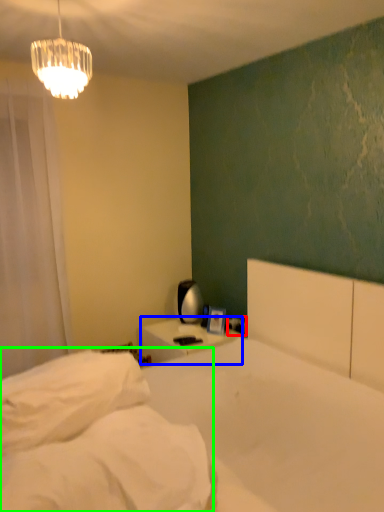
Question: Which is farther away from electric outlet (highlighted by a red box)? nightstand (highlighted by a blue box) or mattress (highlighted by a green box)?

Choices:
 (A) nightstand
 (B) mattress

Answer: (B)